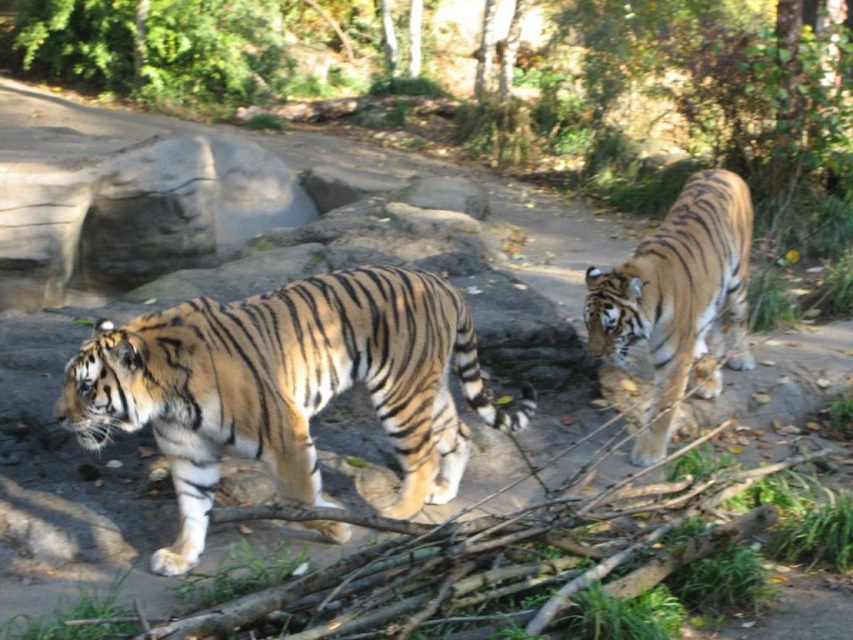
Question: Among these points, which one is nearest to the camera?

Choices:
 (A) (682, 225)
 (B) (189, 385)

Answer: (B)

Question: Among these points, which one is farthest from the camera?

Choices:
 (A) (659, 396)
 (B) (386, 349)

Answer: (A)

Question: Can you confirm if orange-brown striped tiger at left is bigger than orange-brown striped tiger at right?

Choices:
 (A) no
 (B) yes

Answer: (A)

Question: Does orange-brown striped tiger at left come in front of orange-brown striped tiger at right?

Choices:
 (A) yes
 (B) no

Answer: (A)

Question: Is orange-brown striped tiger at left closer to the viewer compared to orange-brown striped tiger at right?

Choices:
 (A) no
 (B) yes

Answer: (B)

Question: Which point is closer to the camera?

Choices:
 (A) (744, 337)
 (B) (357, 324)

Answer: (B)